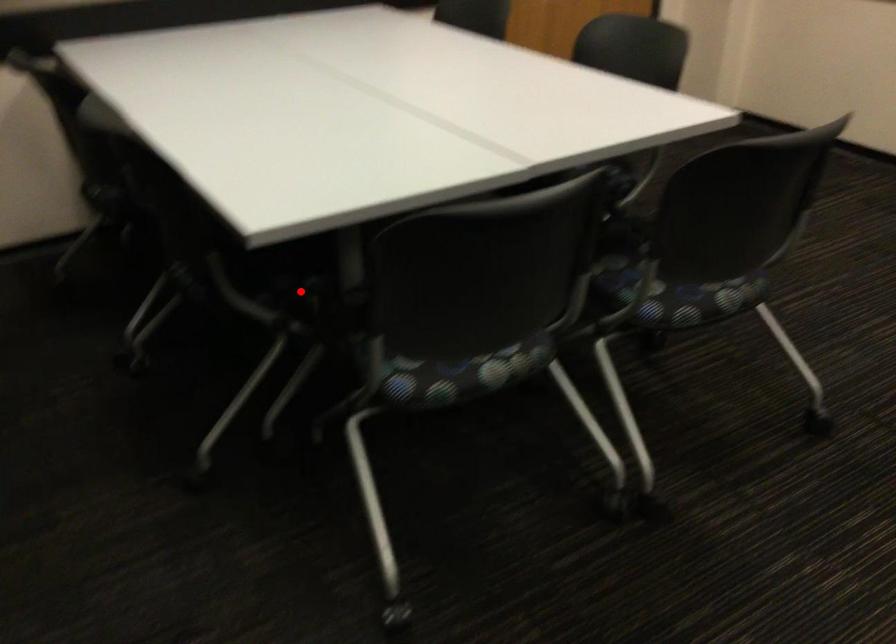
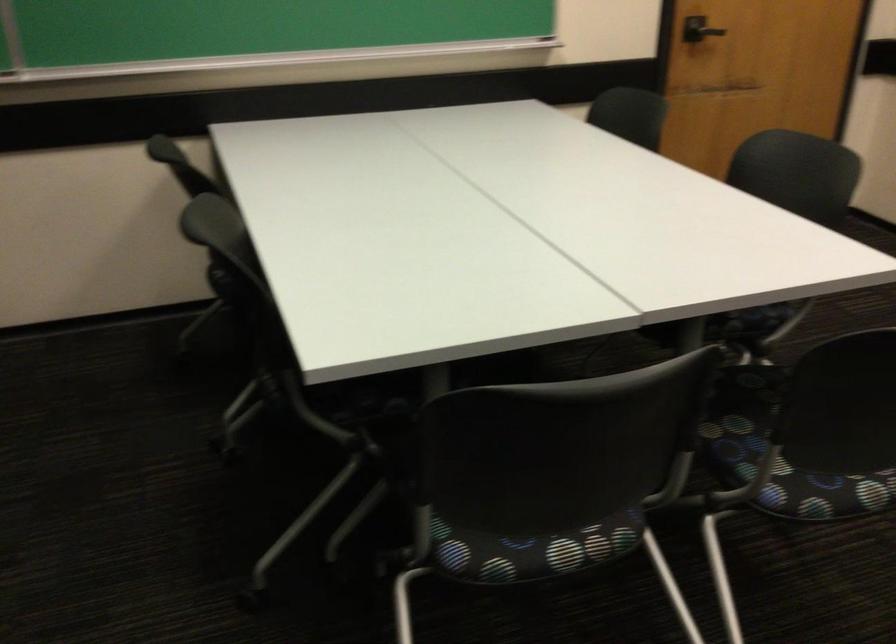
Where in the second image is the point corresponding to the highlighted location from the first image?

(376, 413)